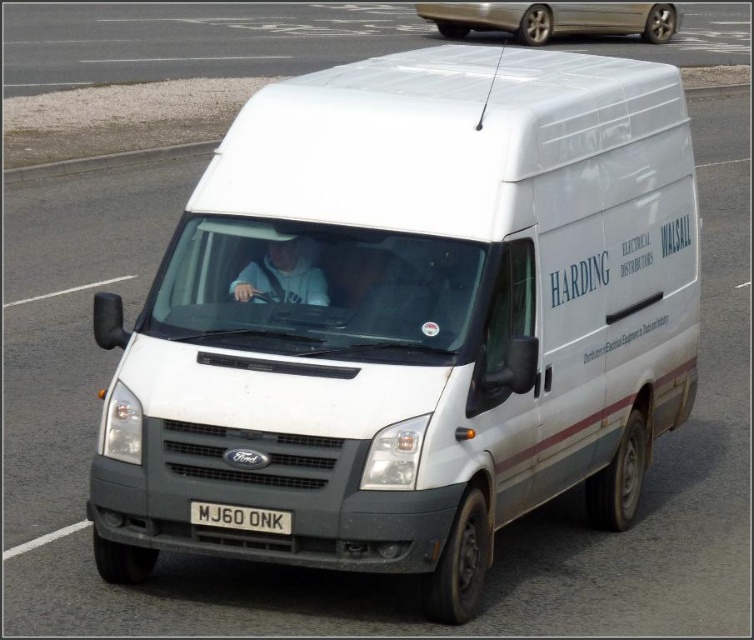
Can you confirm if metallic silver sedan at upper center is taller than white plastic license plate at center?

Yes.

Is point (596, 29) less distant than point (201, 522)?

No, (596, 29) is further to viewer.

Image resolution: width=754 pixels, height=640 pixels. I want to click on metallic silver sedan at upper center, so click(552, 19).